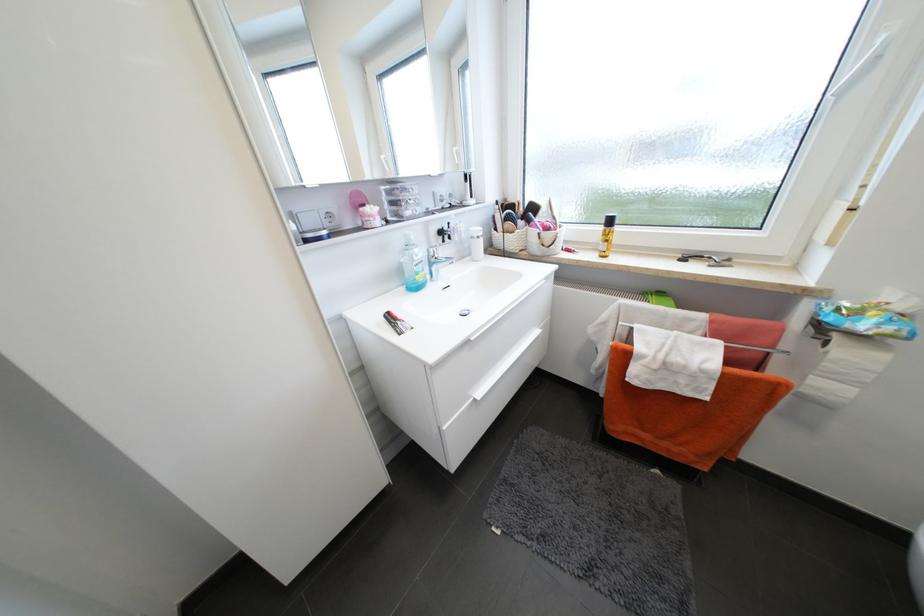
What do you see at coordinates (861, 66) in the screenshot?
I see `the white window handle` at bounding box center [861, 66].